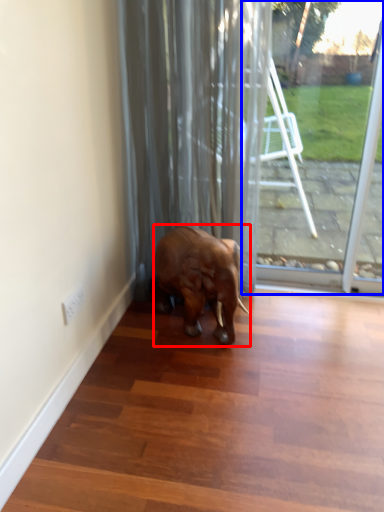
Question: Which object appears closest to the camera in this image, elephant (highlighted by a red box) or glass door (highlighted by a blue box)?

Choices:
 (A) elephant
 (B) glass door

Answer: (A)